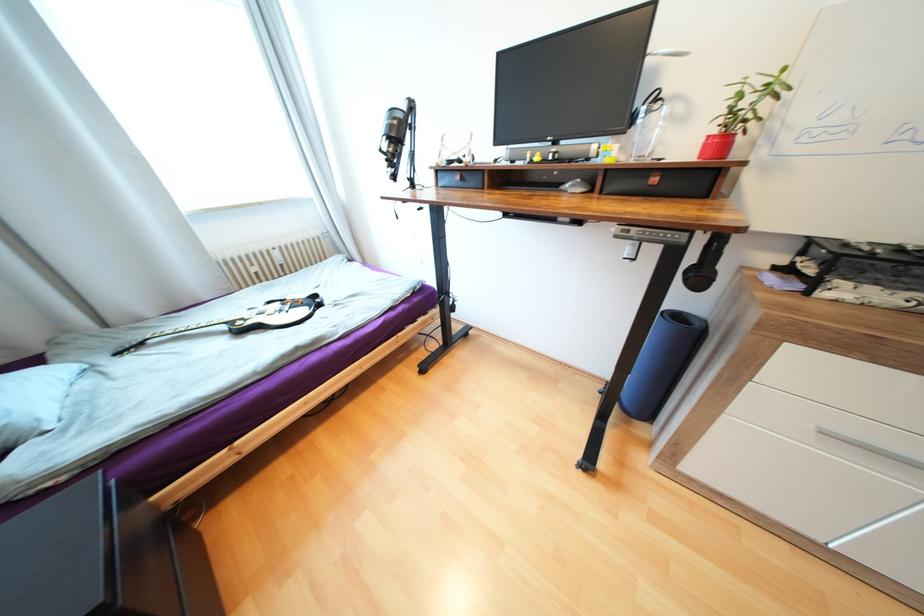
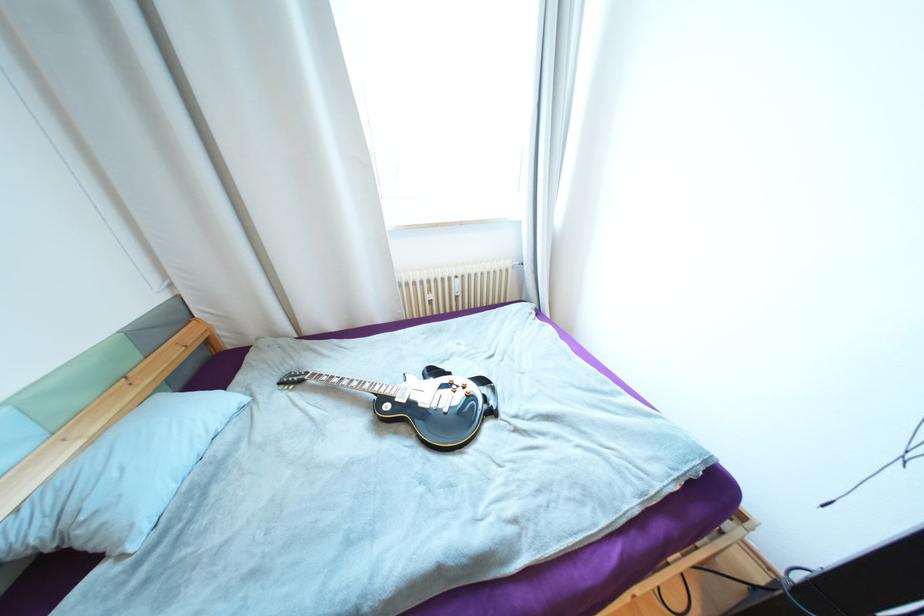
In the second image, find the point that corresponds to pixel 287 265 in the first image.

(463, 297)